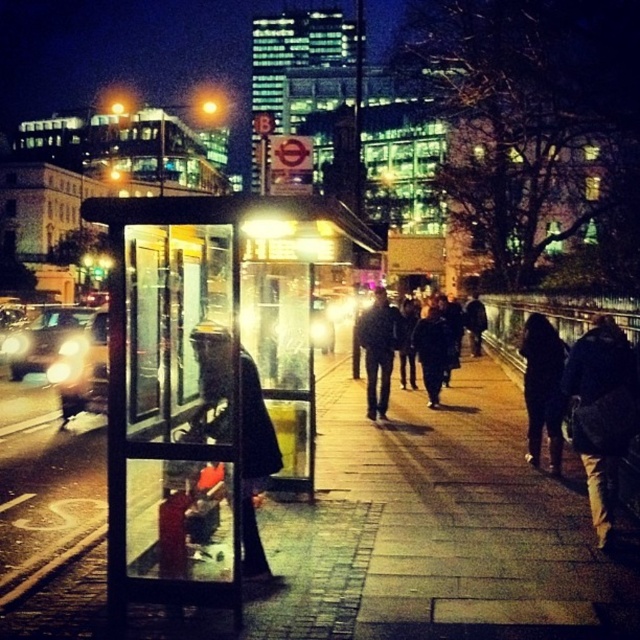
Question: Which of the following is the farthest from the observer?

Choices:
 (A) (424, 362)
 (B) (157, 540)
 (C) (616, 355)

Answer: (A)

Question: Can you confirm if smooth concrete sidewalk at center is bigger than dark wool coat at center?

Choices:
 (A) no
 (B) yes

Answer: (A)

Question: Is brown leather jacket at right smaller than dark blue jacket at center?

Choices:
 (A) yes
 (B) no

Answer: (B)

Question: Can you confirm if dark blue jeans at center is positioned to the right of dark blue jacket at center?

Choices:
 (A) no
 (B) yes

Answer: (A)

Question: Which object appears farthest from the camera in this image?

Choices:
 (A) dark wool coat at center
 (B) dark blue jeans at center
 (C) brown leather jacket at right
 (D) transparent glass bus stop at center

Answer: (A)

Question: Which point is closer to the camera?

Choices:
 (A) black leather jacket at center
 (B) dark blue jacket at center
 (C) smooth concrete sidewalk at center

Answer: (C)